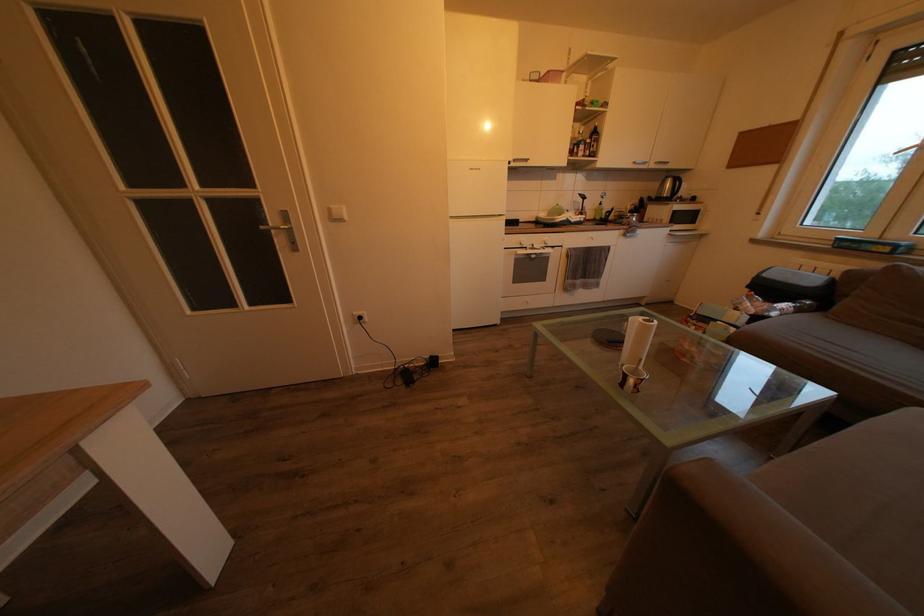
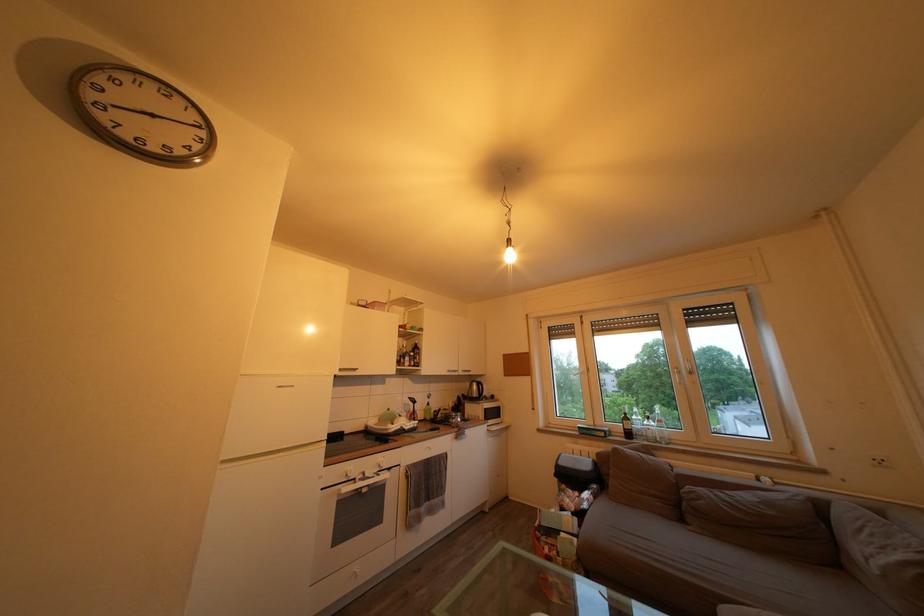
Locate, in the second image, the point that corresponds to point (609, 209) in the first image.

(436, 411)